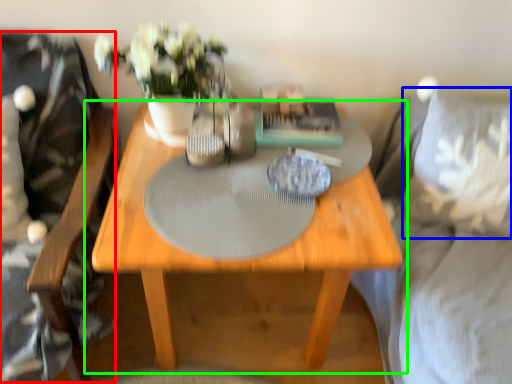
Question: Estimate the real-world distances between objects in this image. Which object is closer to swivel chair (highlighted by a red box), pillow (highlighted by a blue box) or table (highlighted by a green box)?

Choices:
 (A) pillow
 (B) table

Answer: (B)